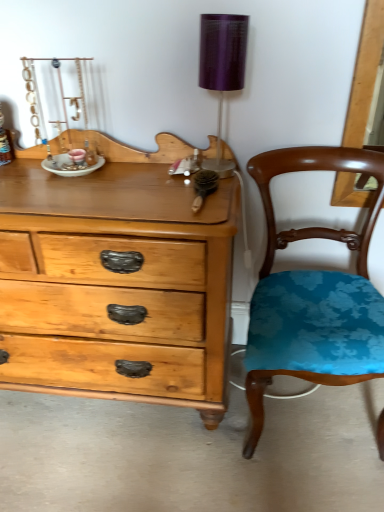
Question: Considering the positions of point click(372, 326) and point click(241, 58), is point click(372, 326) closer or farther from the camera than point click(241, 58)?

Choices:
 (A) farther
 (B) closer

Answer: (A)

Question: Is teal fabric chair at right spatially inside purple fabric lampshade at upper right, or outside of it?

Choices:
 (A) inside
 (B) outside

Answer: (B)

Question: From the image's perspective, relative to purple fabric lampshade at upper right, is teal fabric chair at right above or below?

Choices:
 (A) below
 (B) above

Answer: (A)

Question: From the image's perspective, is purple fabric lampshade at upper right positioned above or below teal fabric chair at right?

Choices:
 (A) above
 (B) below

Answer: (A)

Question: Does point (238, 65) appear closer or farther from the camera than point (273, 245)?

Choices:
 (A) farther
 (B) closer

Answer: (B)

Question: Is purple fabric lampshade at upper right in front of or behind teal fabric chair at right in the image?

Choices:
 (A) front
 (B) behind

Answer: (B)

Question: Is purple fabric lampshade at upper right taller or shorter than teal fabric chair at right?

Choices:
 (A) short
 (B) tall

Answer: (A)